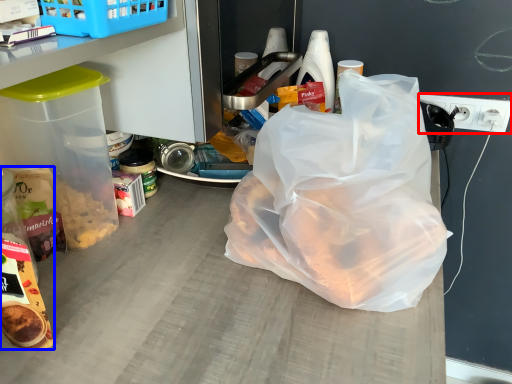
Question: Which object is closer to the camera taking this photo, electric outlet (highlighted by a red box) or snack (highlighted by a blue box)?

Choices:
 (A) electric outlet
 (B) snack

Answer: (B)